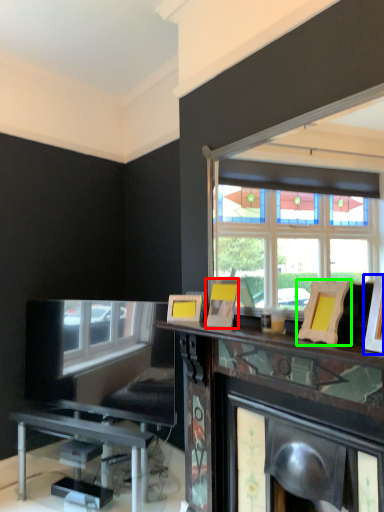
Question: Based on their relative distances, which object is nearer to picture frame (highlighted by a red box)? Choose from picture frame (highlighted by a blue box) and picture frame (highlighted by a green box).

Choices:
 (A) picture frame
 (B) picture frame

Answer: (B)